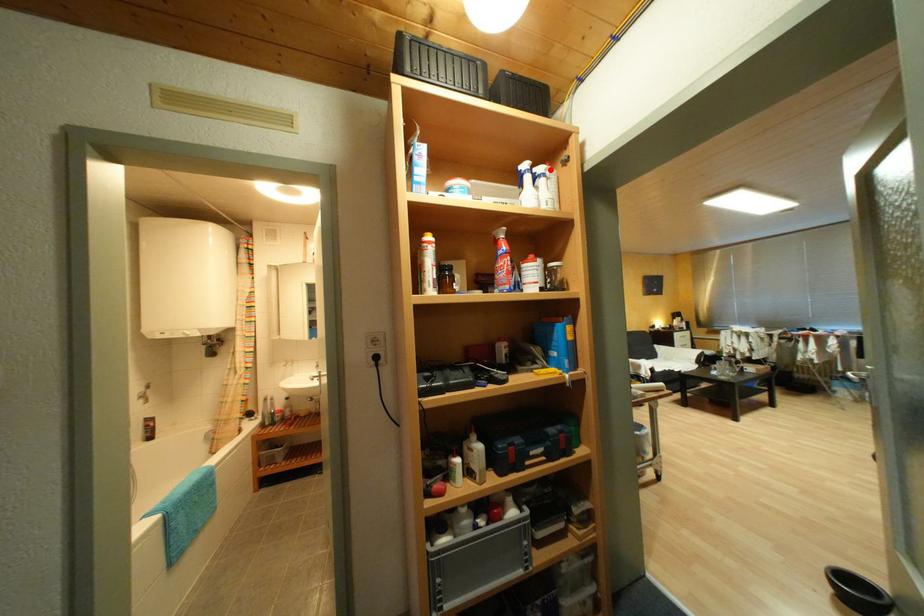
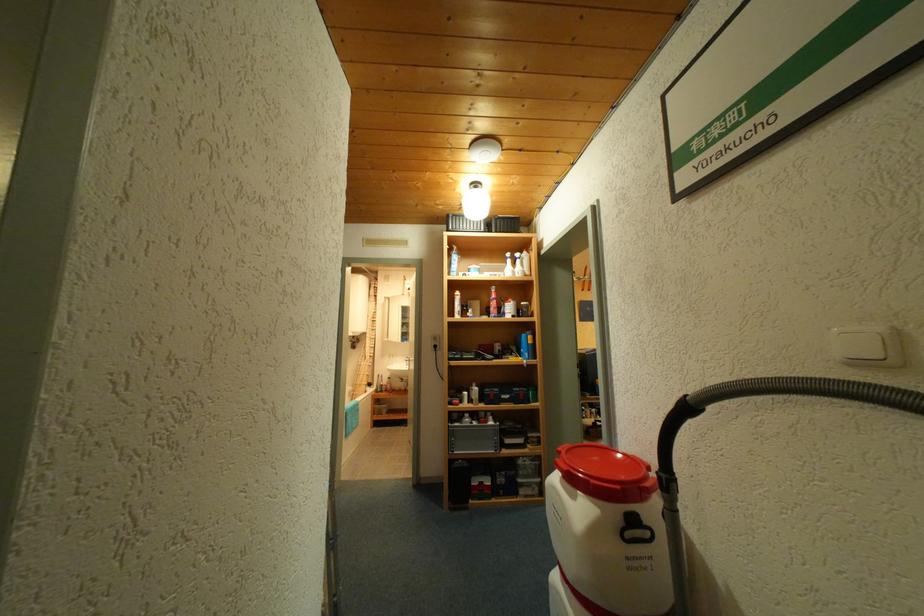
Find the pixel in the second image that matches the highlighted location in the first image.

(527, 256)